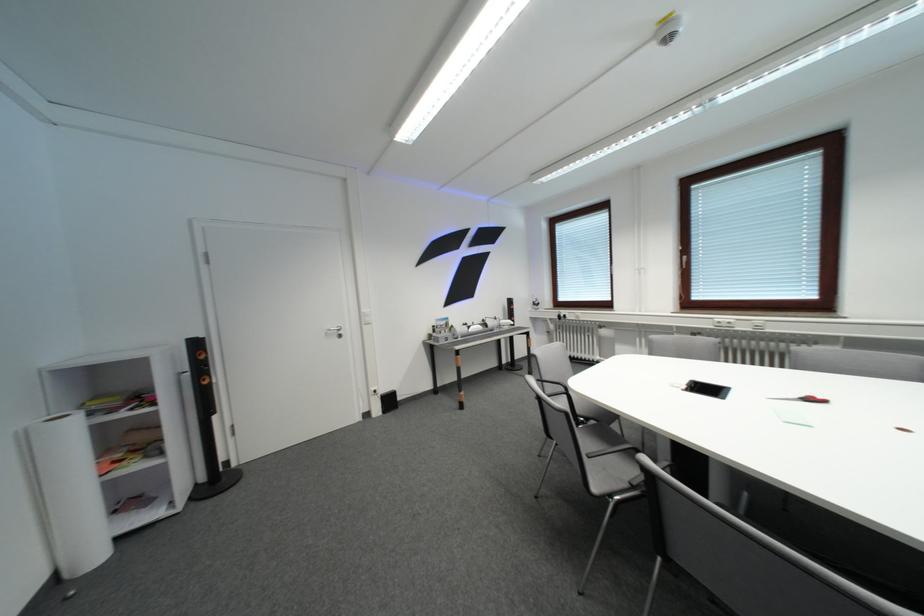
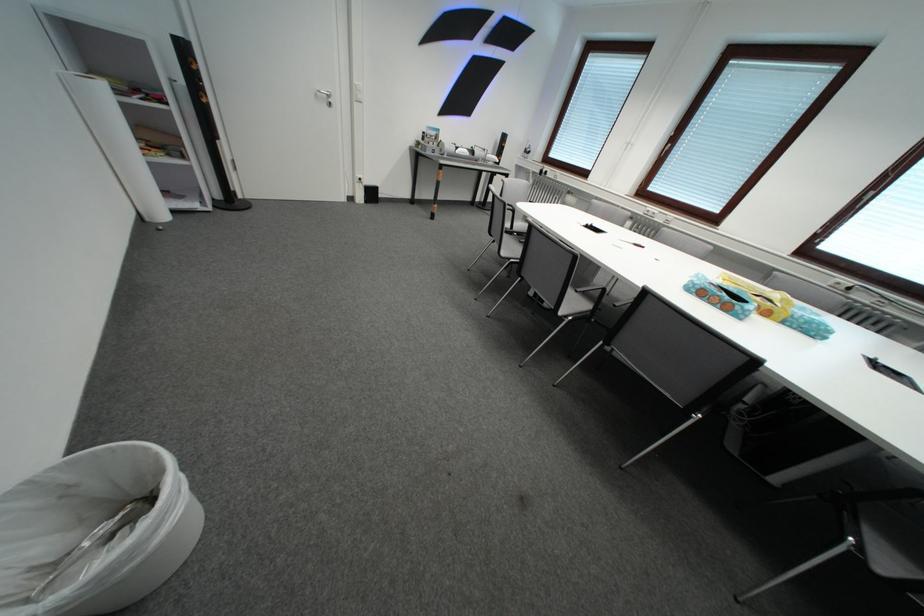
Find the pixel in the second image that matches [226,484] in the first image.

(241, 205)